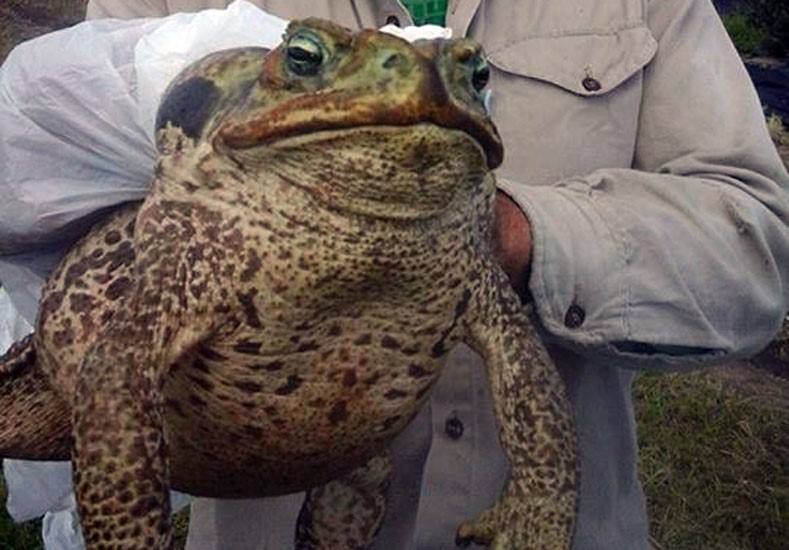
Identify the location of left front leg. The height and width of the screenshot is (550, 789). (124, 467).